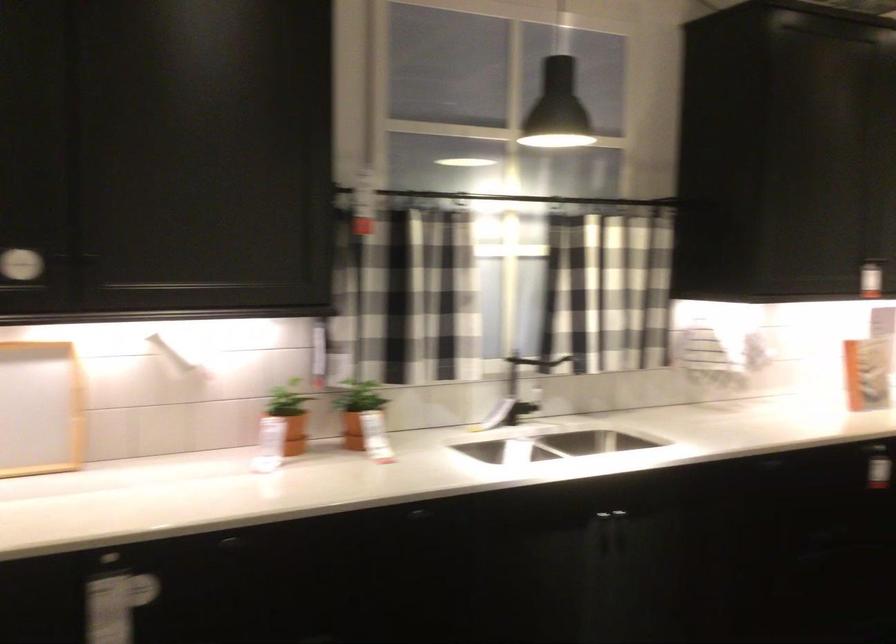
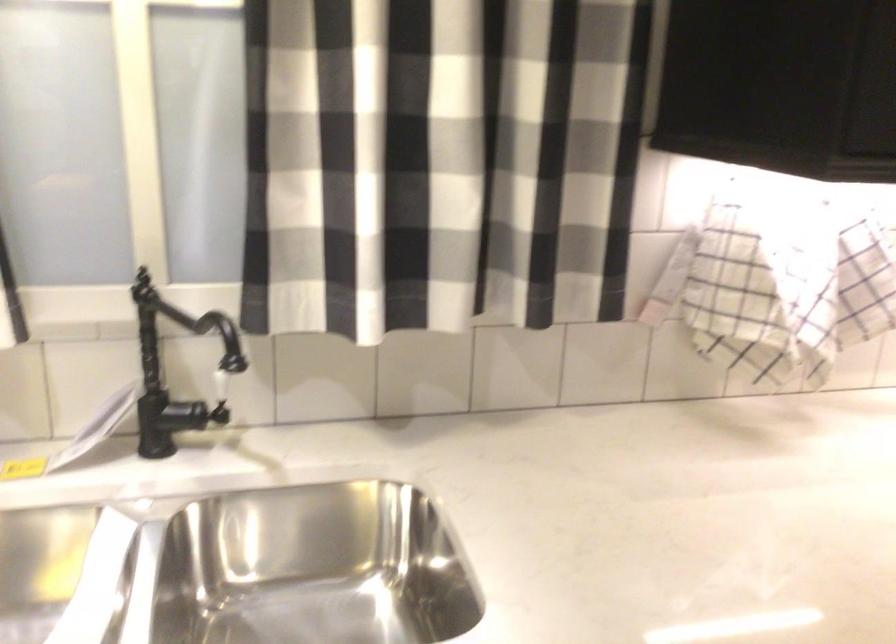
In a continuous first-person perspective shot, in which direction is the camera moving?

The cameraman moved toward right, forward.